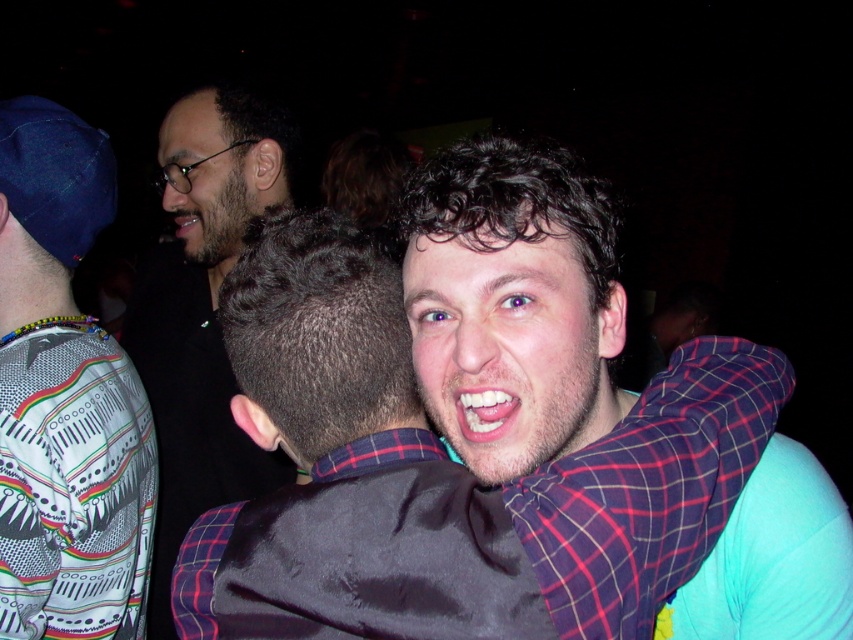
You are a GUI agent. You are given a task and a screenshot of the screen. Output one action in this format:
    pyautogui.click(x=<x>, y=<y>)
    Task: Click on the plaid shirt at center
    The height and width of the screenshot is (640, 853).
    Given the screenshot: What is the action you would take?
    pyautogui.click(x=514, y=304)

Can you confirm if plaid shirt at center is smaller than matte black shirt at upper left?

Correct, plaid shirt at center occupies less space than matte black shirt at upper left.

Can you confirm if plaid shirt at center is thinner than matte black shirt at upper left?

Incorrect, plaid shirt at center's width is not less than matte black shirt at upper left's.

Is point (442, 406) positioned before point (166, 614)?

Yes.

Locate an element on the screen. The image size is (853, 640). plaid shirt at center is located at coordinates (514, 304).

I want to click on white dotted shirt at upper left, so click(64, 396).

Which is in front, point (74, 259) or point (166, 188)?

Point (74, 259) is more forward.

Locate an element on the screen. white dotted shirt at upper left is located at coordinates (64, 396).